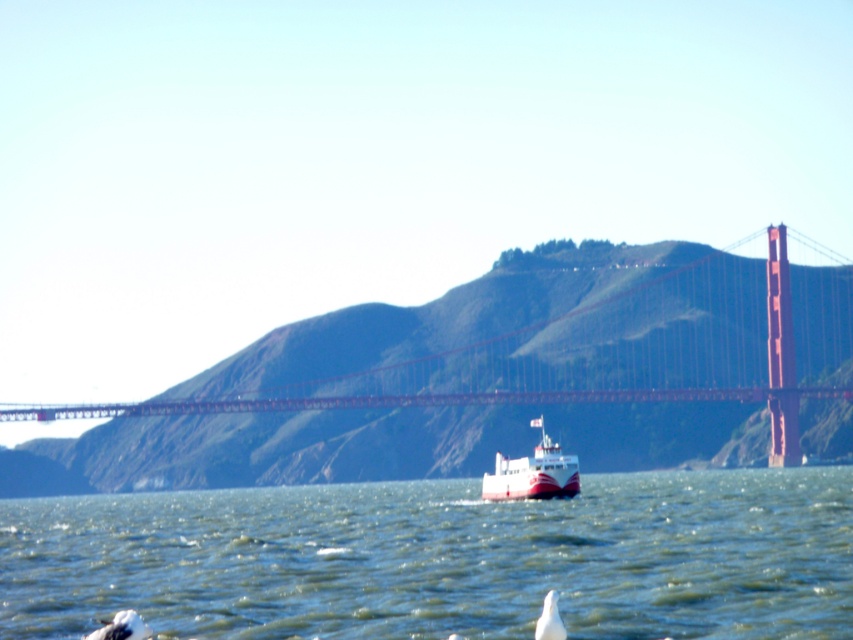
You are a photographer planning to capture the Golden Gate Bridge and the ferry in a single shot. Given that your camera can only focus on objects within a 100m width, can you fit both the metallic red bridge at center and the white glossy ferry at center in the frame without zooming?

The metallic red bridge at center might be wider than the white glossy ferry at center, so it depends on the actual width of the bridge. If the bridge is wider than 100m, the camera might not be able to capture both in the same frame without zooming.

You are a photographer planning to capture a wide shot of the Golden Gate Bridge. You notice the greenish water at center and the white matte bird at lower left in your frame. Given their distance apart, can you estimate if they will appear close to each other in the photo?

The greenish water at center and the white matte bird at lower left are 140.06 meters apart from each other. In a wide shot, objects 140 meters apart might appear farther apart than they seem, so they may not look close in the photo.

You are standing on the Golden Gate Bridge and looking down. You see the greenish water at center and the white glossy ferry at center. Which object is closer to you?

The greenish water at center is closer to you because it is in front of the white glossy ferry at center.